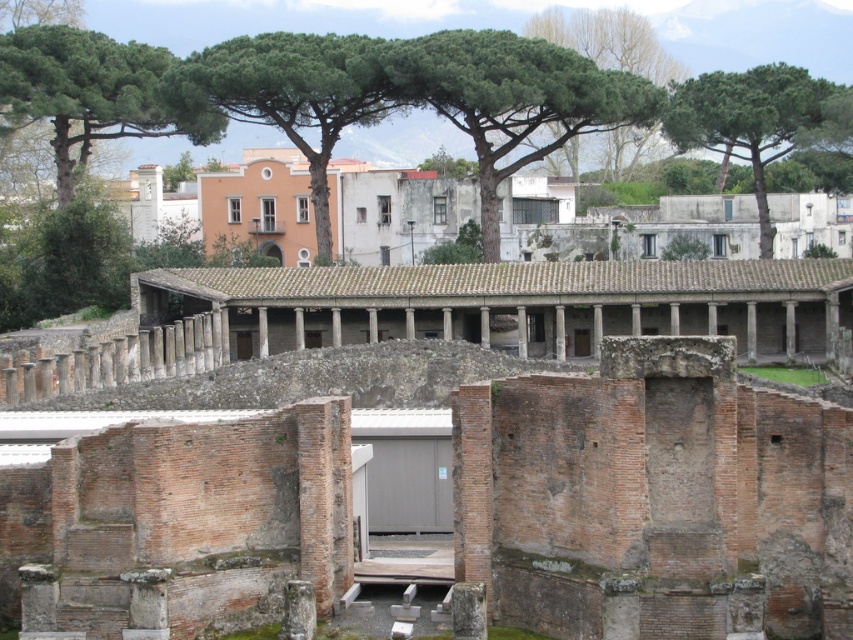
Is point (601, 81) more distant than point (825, 96)?

No, it is not.

Where is `green leafy tree at upper center`? green leafy tree at upper center is located at coordinates point(514,99).

I want to click on green leafy tree at upper center, so click(514, 99).

Is green leafy tree at upper left above green leafy tree at upper right?

Yes, green leafy tree at upper left is above green leafy tree at upper right.

How far apart are green leafy tree at upper left and green leafy tree at upper right?

green leafy tree at upper left and green leafy tree at upper right are 40.64 meters apart.

Between point (84, 81) and point (757, 148), which one is positioned behind?

The point (757, 148) is more distant.

At what (x,y) coordinates should I click in order to perform the action: click on green leafy tree at upper left. Please return your answer as a coordinate pair (x, y). Looking at the image, I should click on (91, 93).

Can you confirm if brown stone amphitheater at center is smaller than green leafy tree at upper right?

No, brown stone amphitheater at center is not smaller than green leafy tree at upper right.

Between point (173, 314) and point (753, 99), which one is positioned in front?

Point (173, 314) is more forward.

In order to click on brown stone amphitheater at center in this screenshot , I will do `click(514, 304)`.